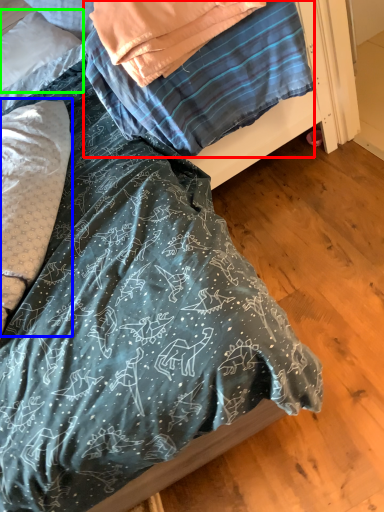
Question: Which object is positioned closest to blanket (highlighted by a red box)? Select from pillow (highlighted by a blue box) and pillow (highlighted by a green box).

Choices:
 (A) pillow
 (B) pillow

Answer: (A)